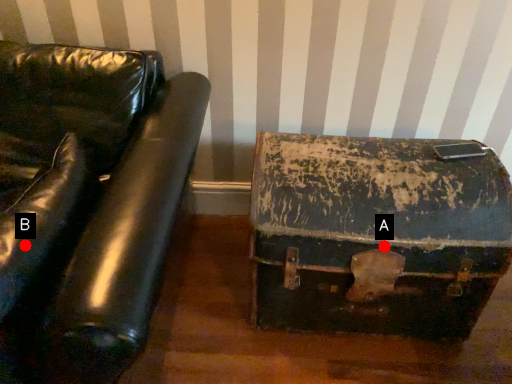
Question: Two points are circled on the image, labeled by A and B beside each circle. Which point appears closest to the camera in this image?

Choices:
 (A) A is closer
 (B) B is closer

Answer: (B)